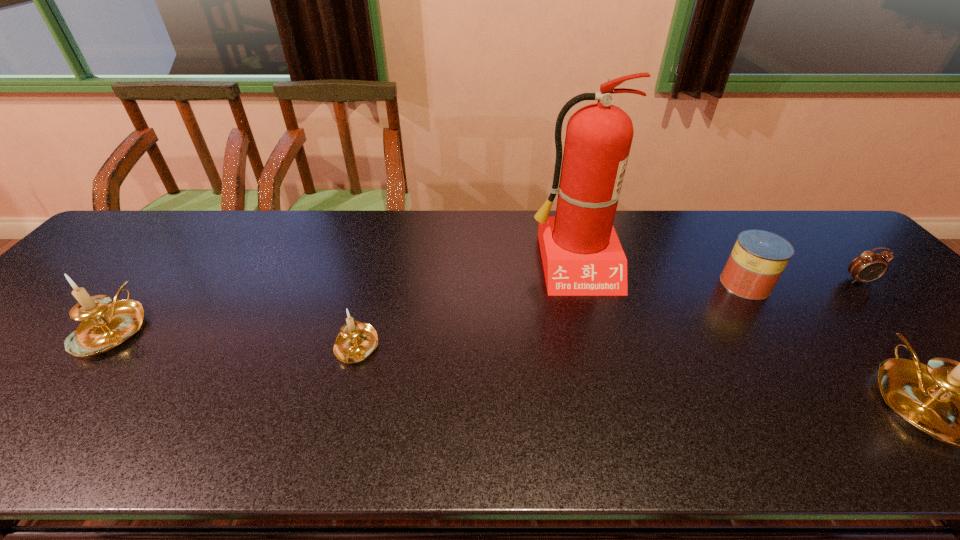
Point out which object is positioned as the fourth nearest to the fire extinguisher. Please provide its 2D coordinates. Your answer should be formatted as a tuple, i.e. [(x, y)], where the tuple contains the x and y coordinates of a point satisfying the conditions above.

[(869, 266)]

Select which object appears as the second closest to the rightmost candle holder. Please provide its 2D coordinates. Your answer should be formatted as a tuple, i.e. [(x, y)], where the tuple contains the x and y coordinates of a point satisfying the conditions above.

[(869, 266)]

Select which candle holder appears as the second closest to the rightmost candle holder. Please provide its 2D coordinates. Your answer should be formatted as a tuple, i.e. [(x, y)], where the tuple contains the x and y coordinates of a point satisfying the conditions above.

[(105, 325)]

Locate an element on the screen. The image size is (960, 540). candle holder identified as the closest to the can is located at coordinates (959, 403).

I want to click on free spot that satisfies the following two spatial constraints: 1. on the front-facing side of the can; 2. on the left side of the fire extinguisher, so click(x=579, y=284).